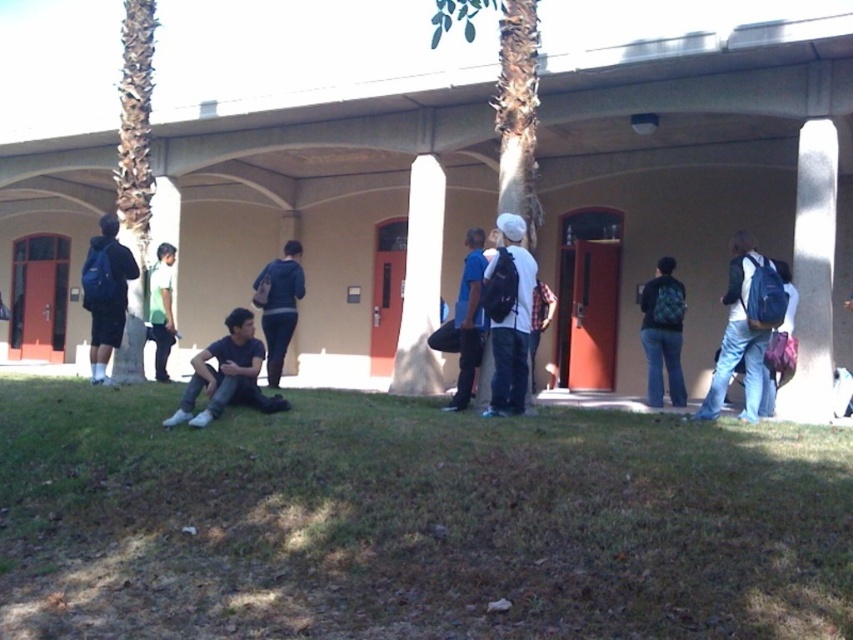
You are standing at the entrance of the building and want to retrieve your backpacks. Which backpack is closer to the left side of the covered walkway, the matte blue backpack at left or the matte black backpack at center right?

The matte blue backpack at left is closer to the left side of the covered walkway because it is positioned to the left of the matte black backpack at center right.